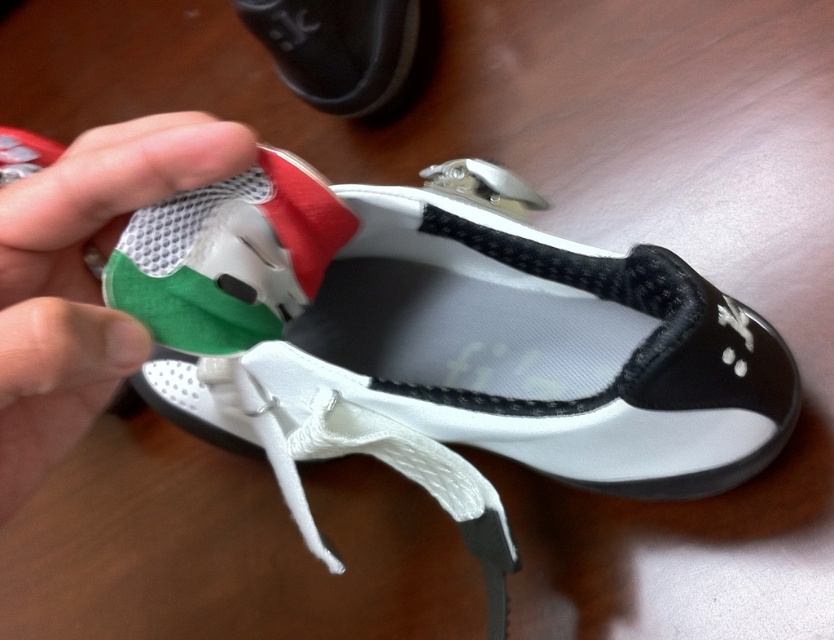
You are a designer looking at the sneaker design. The white mesh shoe at center and the green mesh fabric at lower left are both part of the sneaker. Which one is positioned higher?

The white mesh shoe at center is located above the green mesh fabric at lower left, so it is positioned higher.

You are trying to decide which shoe to wear today. You see a white mesh shoe at center and a matte black shoe at upper center. Which one is wider?

The white mesh shoe at center is wider than the matte black shoe at upper center according to the description.

You are a sneaker enthusiast examining two shoes in the image. You notice the white mesh shoe at center and the matte black shoe at upper center. Which shoe is positioned closer to your line of sight?

The white mesh shoe at center is closer to the viewer than the matte black shoe at upper center.